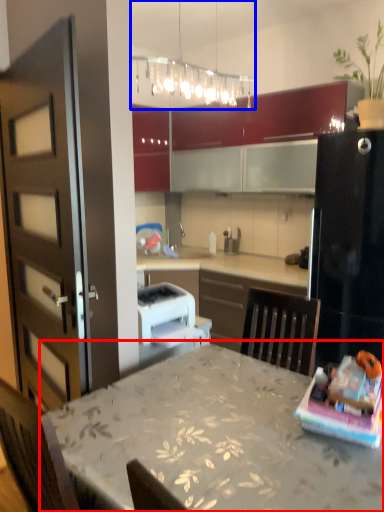
Question: Which object is further to the camera taking this photo, table (highlighted by a red box) or light fixture (highlighted by a blue box)?

Choices:
 (A) table
 (B) light fixture

Answer: (B)